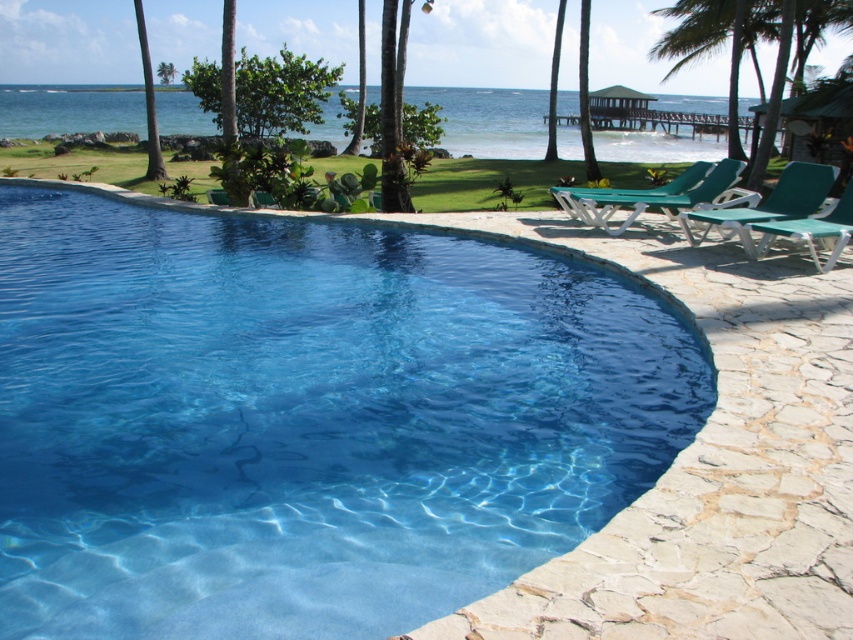
Is point (747, 6) farther from viewer compared to point (802, 195)?

Yes, point (747, 6) is farther from viewer.

Does point (730, 104) come farther from viewer compared to point (788, 196)?

Yes.

I want to click on green leafy palm tree at upper right, so [717, 42].

Is point (737, 4) behind point (740, 164)?

Yes, it is.

Does green leafy palm tree at upper right have a greater height compared to green plastic beach chair at right?

Correct, green leafy palm tree at upper right is much taller as green plastic beach chair at right.

Is point (666, 10) farther from viewer compared to point (727, 179)?

That is True.

Locate an element on the screen. This screenshot has height=640, width=853. green leafy palm tree at upper right is located at coordinates (717, 42).

Which is below, teal plastic beach chair at right or green plastic beach chair at right?

teal plastic beach chair at right is below.

Is teal plastic beach chair at right behind green plastic beach chair at right?

No, teal plastic beach chair at right is closer to the viewer.

What are the coordinates of `teal plastic beach chair at right` in the screenshot? It's located at (764, 204).